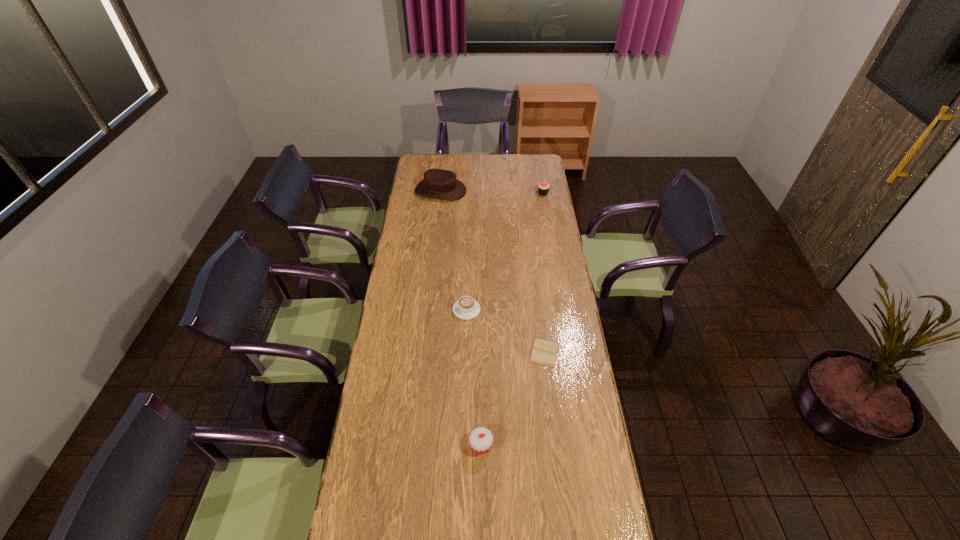
Identify the location of vacant point located 0.090m on the front of the left cupcake. (481, 485).

What are the coordinates of `vacant space situated with the handle on the right side of the cappuccino` in the screenshot? It's located at (496, 310).

Locate an element on the screen. vacant point located 0.260m on the front of the shortest object is located at coordinates (555, 430).

This screenshot has height=540, width=960. I want to click on object present at the left edge, so [438, 183].

Where is `cupcake located in the right edge section of the desktop`? cupcake located in the right edge section of the desktop is located at coordinates point(543,187).

At what (x,y) coordinates should I click in order to perform the action: click on diary that is at the right edge. Please return your answer as a coordinate pair (x, y). This screenshot has height=540, width=960. Looking at the image, I should click on (544, 352).

Find the location of a particular element. The width and height of the screenshot is (960, 540). free space at the far edge of the desktop is located at coordinates point(480,168).

Identify the location of vacant space at the left edge of the desktop. (401, 309).

In the image, there is a desktop. Identify the location of vacant space at the right edge. (531, 178).

Where is `unoccupied area between the shortest object and the fourth tallest object`? unoccupied area between the shortest object and the fourth tallest object is located at coordinates (506, 331).